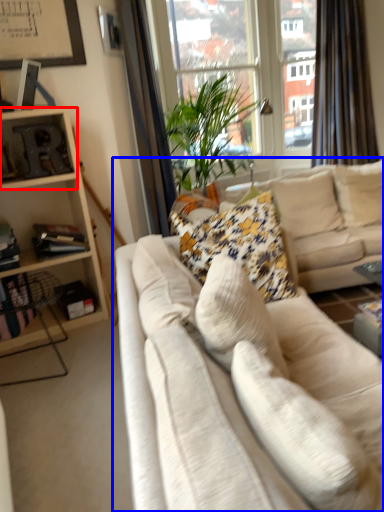
Question: Which point is further to the camera, shelf (highlighted by a red box) or studio couch (highlighted by a blue box)?

Choices:
 (A) shelf
 (B) studio couch

Answer: (A)